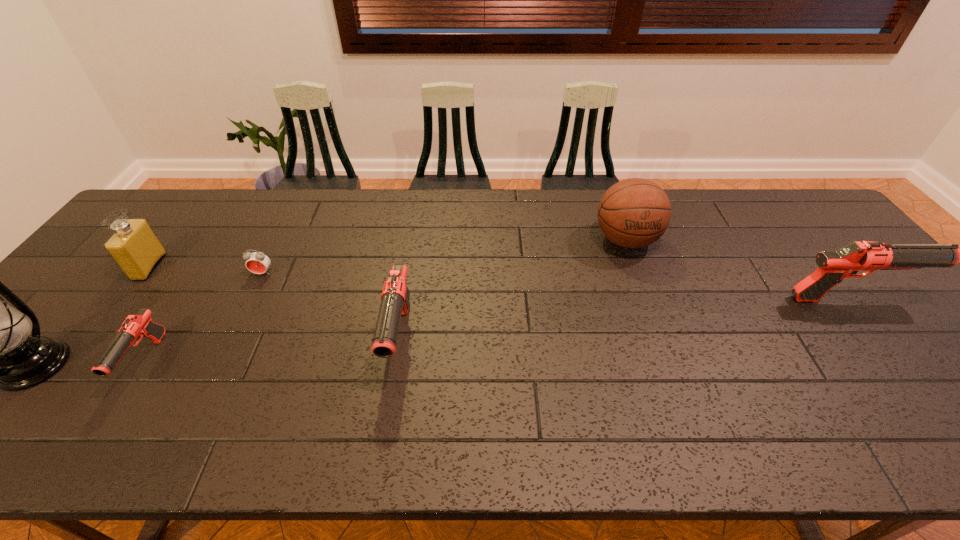
Locate an element on the screen. This screenshot has width=960, height=540. free location that satisfies the following two spatial constraints: 1. at the aiming end of the rightmost object; 2. at the aiming end of the third object from right to left is located at coordinates (880, 339).

The image size is (960, 540). Find the location of `vacant region that satisfies the following two spatial constraints: 1. at the aiming end of the rightmost object; 2. at the aiming end of the third object from right to left`. vacant region that satisfies the following two spatial constraints: 1. at the aiming end of the rightmost object; 2. at the aiming end of the third object from right to left is located at coordinates (880, 339).